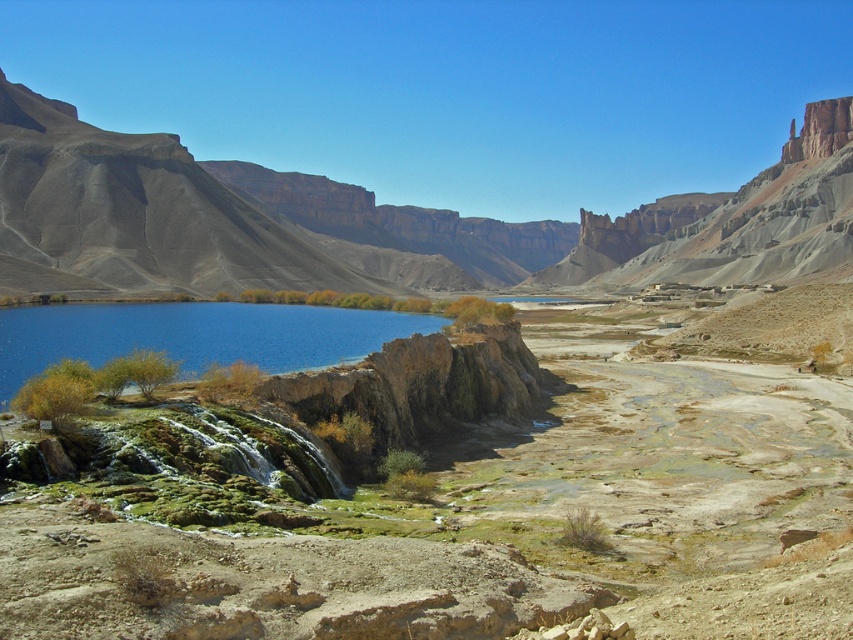
Can you confirm if rustic brown cliff at left is shorter than blue water at center?

In fact, rustic brown cliff at left may be taller than blue water at center.

Is point (331, 180) positioned behind point (160, 304)?

Yes, point (331, 180) is behind point (160, 304).

Identify the location of rustic brown cliff at left. (376, 220).